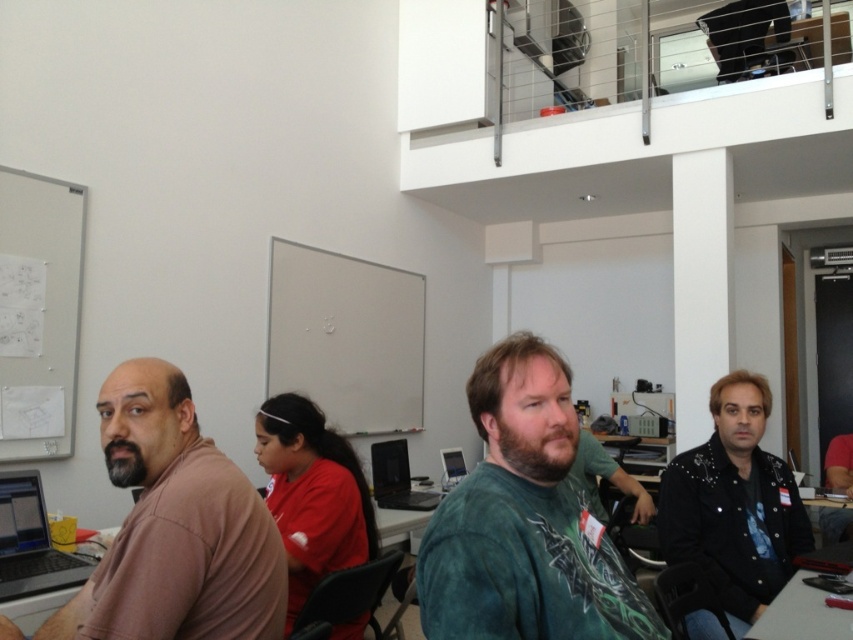
You are a photographer setting up a shoot in this office. You want to place a prop between the black studded leather jacket at lower right and the matte red shirt at center so that it is closer to the camera than the jacket. Is this possible?

The black studded leather jacket at lower right is further to the viewer than the matte red shirt at center, so placing a prop closer to the camera than the jacket would mean placing it between the camera and the jacket, but the matte red shirt at center is already behind the jacket. Therefore, it is not possible to place the prop between them while keeping it closer to the camera than the jacket.

You are standing in the office and want to move from point A to point B. Point A is at coordinate point (16, 518) and point B is at coordinate point (390, 506). Which point is closer to your current position if you are facing the scene?

Point A is closer to the camera than point B, so if you are facing the scene, point A is closer to your current position.

You are organizing a tech event and need to place both the black plastic laptop at center and the matte black monitor at center on a table. Given that the table has limited space, which object should you prioritize placing first to ensure both fit?

The matte black monitor at center is smaller than the black plastic laptop at center, so you should place the black plastic laptop at center first to accommodate its larger size, ensuring both fit on the table.